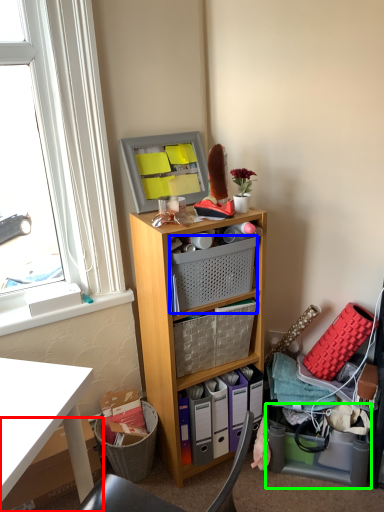
Question: Estimate the real-world distances between objects in this image. Which object is closer to box (highlighted by a red box), basket (highlighted by a blue box) or storage box (highlighted by a green box)?

Choices:
 (A) basket
 (B) storage box

Answer: (A)